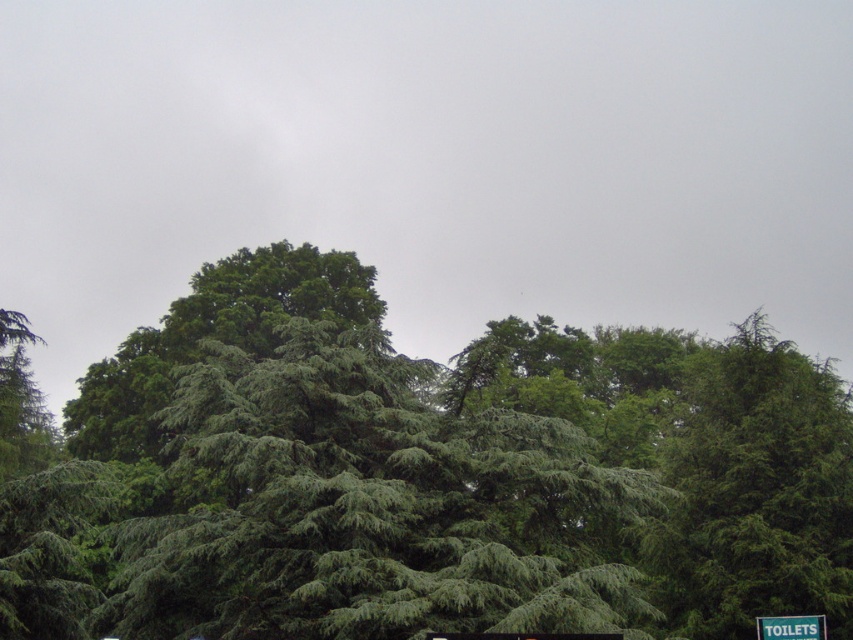
Where is `green needle-like at center`? green needle-like at center is located at coordinates click(418, 476).

Which is above, green needle-like at center or green plastic sign at lower center?

green needle-like at center is above.

You are a GUI agent. You are given a task and a screenshot of the screen. Output one action in this format:
    pyautogui.click(x=<x>, y=<y>)
    Task: Click on the green needle-like at center
    
    Given the screenshot: What is the action you would take?
    pyautogui.click(x=418, y=476)

This screenshot has width=853, height=640. In order to click on green needle-like at center in this screenshot , I will do `click(418, 476)`.

Which is in front, point (212, 586) or point (821, 621)?

Point (212, 586) is more forward.

Who is more forward, [831,620] or [766,627]?

Point [766,627] is in front.

Where is `green needle-like at center`? The image size is (853, 640). green needle-like at center is located at coordinates (418, 476).

In the scene shown: Is the position of green plastic sign at upper right more distant than that of green plastic sign at lower center?

Yes, it is behind green plastic sign at lower center.

Based on the photo, does green plastic sign at upper right have a greater height compared to green plastic sign at lower center?

Yes, green plastic sign at upper right is taller than green plastic sign at lower center.

Where is `green plastic sign at upper right`? green plastic sign at upper right is located at coordinates (791, 627).